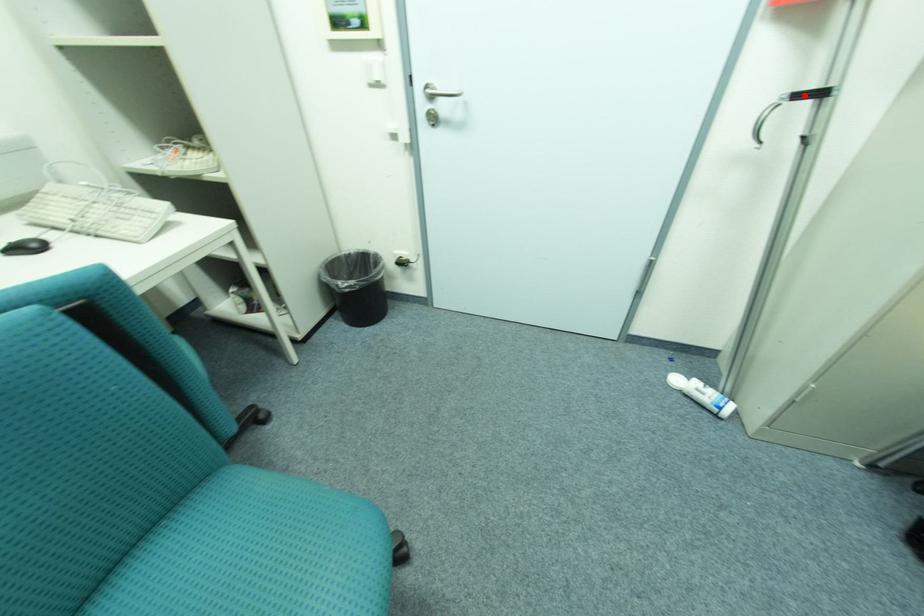
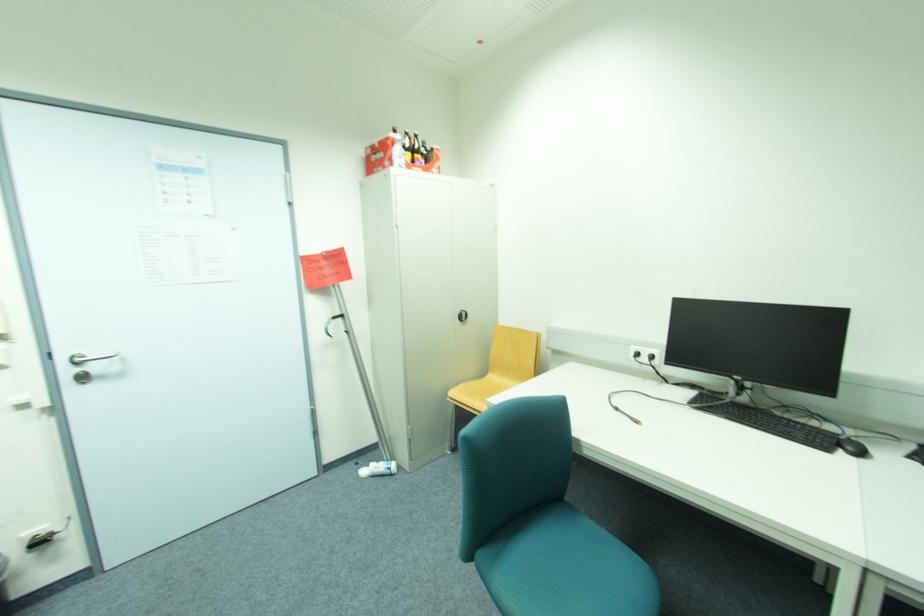
In the second image, find the point that corresponds to the highlighted location in the first image.

(339, 317)